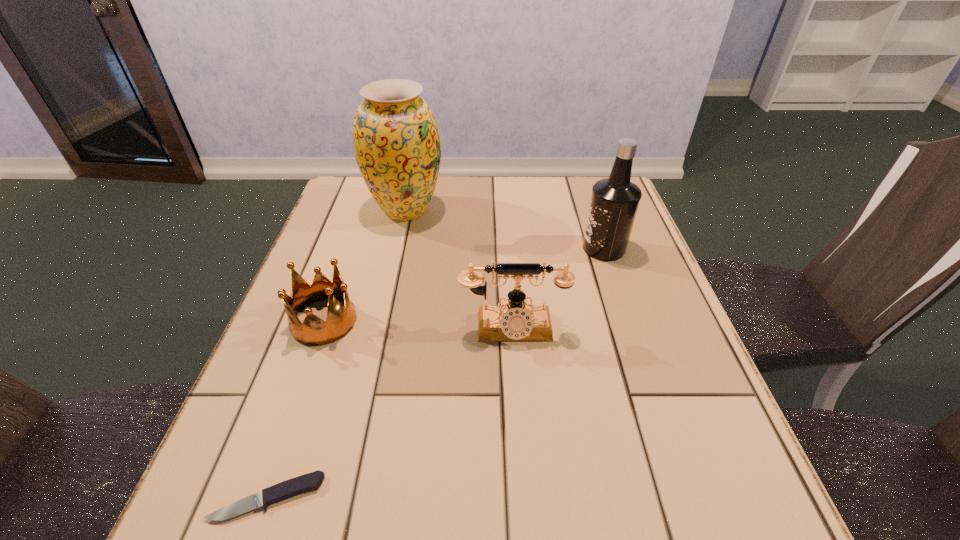
Identify which object is the second closest to the nearest object. Please provide its 2D coordinates. Your answer should be formatted as a tuple, i.e. [(x, y)], where the tuple contains the x and y coordinates of a point satisfying the conditions above.

[(515, 322)]

Identify the location of vacant space that satisfies the following two spatial constraints: 1. on the front side of the nearest object; 2. on the right side of the second shortest object. (261, 497).